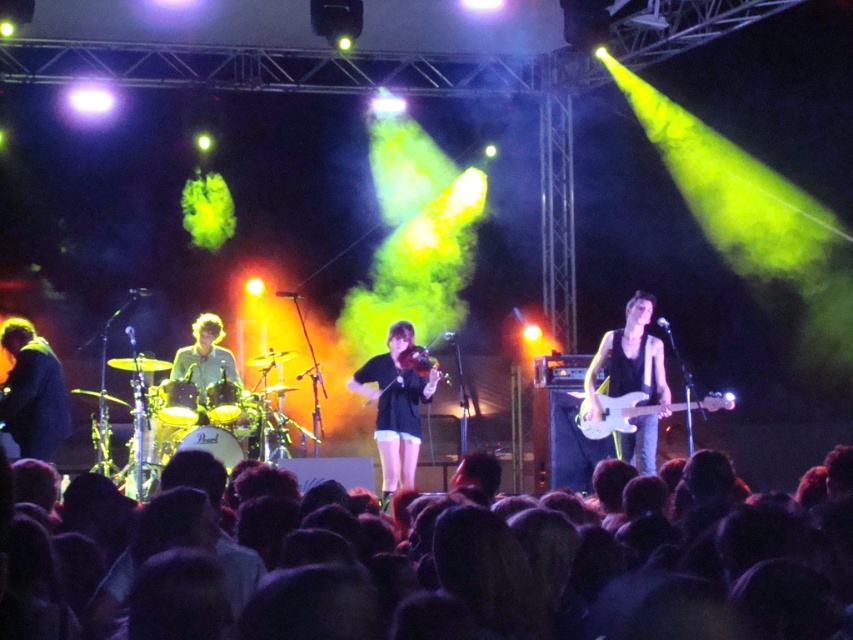
Question: Is dark hair at lower center bigger than matte black violin at center?

Choices:
 (A) no
 (B) yes

Answer: (B)

Question: Does dark hair at lower center have a greater width compared to matte black violin at center?

Choices:
 (A) no
 (B) yes

Answer: (B)

Question: Among these points, which one is farthest from the camera?

Choices:
 (A) (422, 525)
 (B) (631, 392)
 (C) (653, 460)

Answer: (B)

Question: Which object appears closest to the camera in this image?

Choices:
 (A) dark blue fabric jacket at left
 (B) green matte shirt at center

Answer: (A)

Question: In this image, where is dark hair at lower center located relative to black matte shirt at center?

Choices:
 (A) right
 (B) left

Answer: (A)

Question: Among these objects, which one is nearest to the camera?

Choices:
 (A) green matte shirt at center
 (B) dark blue fabric jacket at left
 (C) matte black violin at center

Answer: (B)